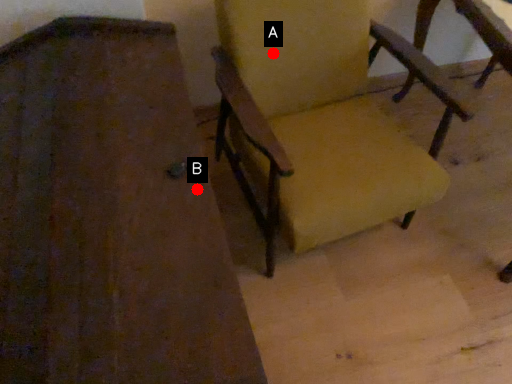
Question: Two points are circled on the image, labeled by A and B beside each circle. Which point is closer to the camera?

Choices:
 (A) A is closer
 (B) B is closer

Answer: (B)